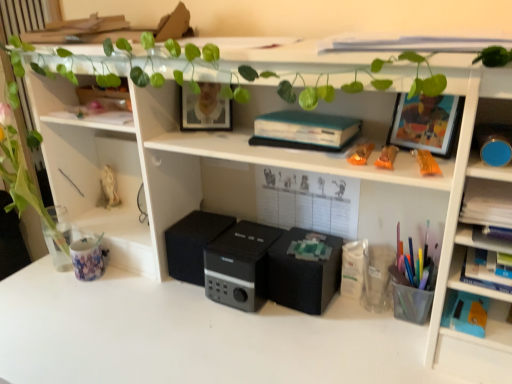
This screenshot has height=384, width=512. I want to click on free space above teal matte book at center (from a real-world perspective), so click(x=316, y=118).